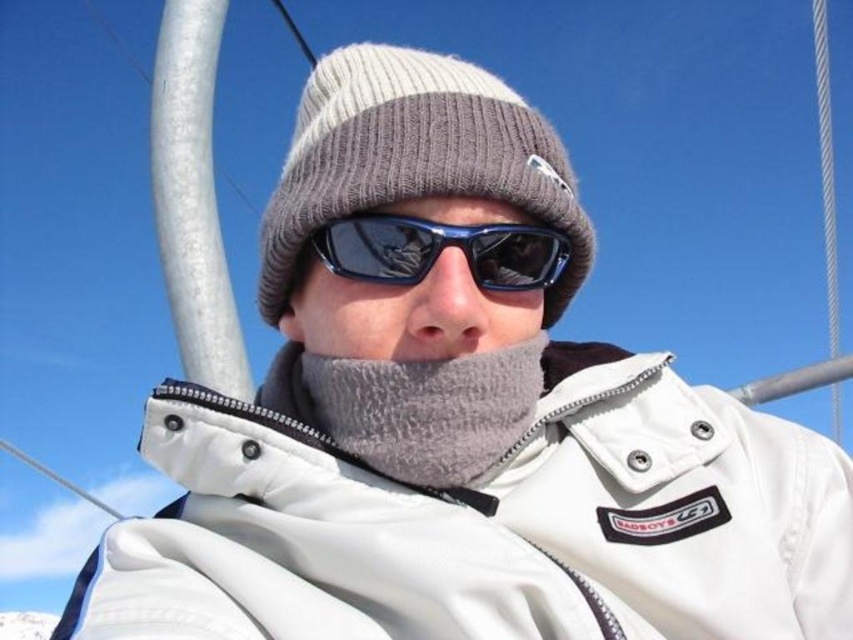
You are a photographer trying to capture a closeup shot of the gray fuzzy scarf at center and the blue reflective plastic goggles at center. Which object is wider when viewed from your current position?

The gray fuzzy scarf at center is wider than the blue reflective plastic goggles at center.

Consider the image. You are a photographer trying to capture the subject in the image. Since you want to ensure both the white fleece jacket at center and the blue reflective plastic goggles at center are clearly visible, which object should you focus on first to ensure proper exposure, considering their sizes?

The white fleece jacket at center is larger in size than the blue reflective plastic goggles at center, so you should focus on the white fleece jacket at center first to ensure proper exposure, as larger objects often require more precise focus and exposure adjustments to capture details effectively.